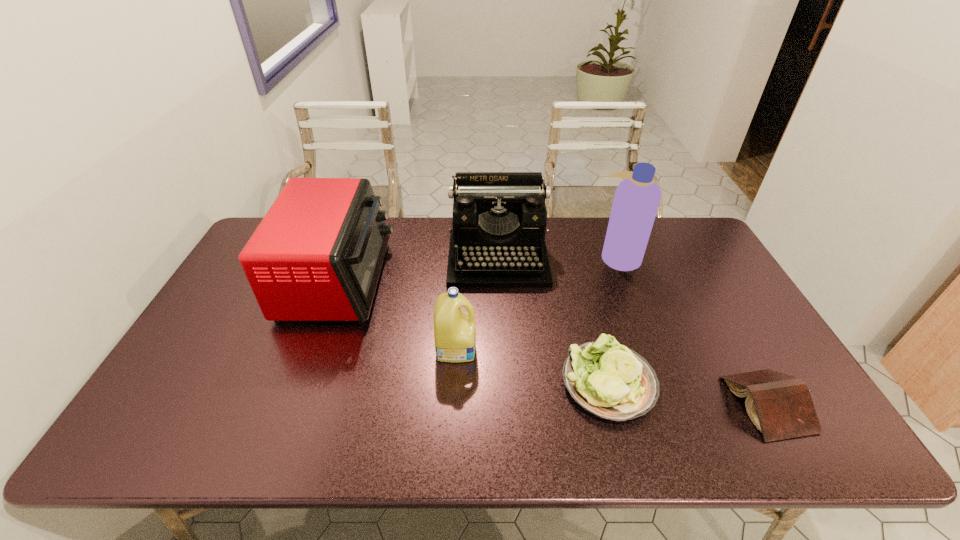
This screenshot has height=540, width=960. In order to click on vacant space in between the shortest object and the tallest object in this screenshot , I will do `click(693, 330)`.

Find the location of a particular element. vacant region between the typewriter and the tallest object is located at coordinates (559, 258).

Identify which object is the fifth nearest to the third shortest object. Please provide its 2D coordinates. Your answer should be formatted as a tuple, i.e. [(x, y)], where the tuple contains the x and y coordinates of a point satisfying the conditions above.

[(780, 406)]

Select which object appears as the third closest to the shampoo. Please provide its 2D coordinates. Your answer should be formatted as a tuple, i.e. [(x, y)], where the tuple contains the x and y coordinates of a point satisfying the conditions above.

[(780, 406)]

Locate an element on the screen. This screenshot has width=960, height=540. free space that satisfies the following two spatial constraints: 1. on the back side of the rightmost object; 2. on the label of the detergent is located at coordinates (735, 347).

The height and width of the screenshot is (540, 960). Find the location of `vacant space that satisfies the following two spatial constraints: 1. on the label of the fourth tallest object; 2. on the right side of the shortest object`. vacant space that satisfies the following two spatial constraints: 1. on the label of the fourth tallest object; 2. on the right side of the shortest object is located at coordinates (453, 404).

Locate an element on the screen. vacant space that satisfies the following two spatial constraints: 1. on the front-facing side of the toaster oven; 2. on the back side of the rightmost object is located at coordinates (294, 404).

I want to click on free point that satisfies the following two spatial constraints: 1. on the label of the rightmost object; 2. on the left side of the detergent, so click(x=453, y=404).

Image resolution: width=960 pixels, height=540 pixels. I want to click on free spot that satisfies the following two spatial constraints: 1. on the label of the third shortest object; 2. on the right side of the book, so click(453, 404).